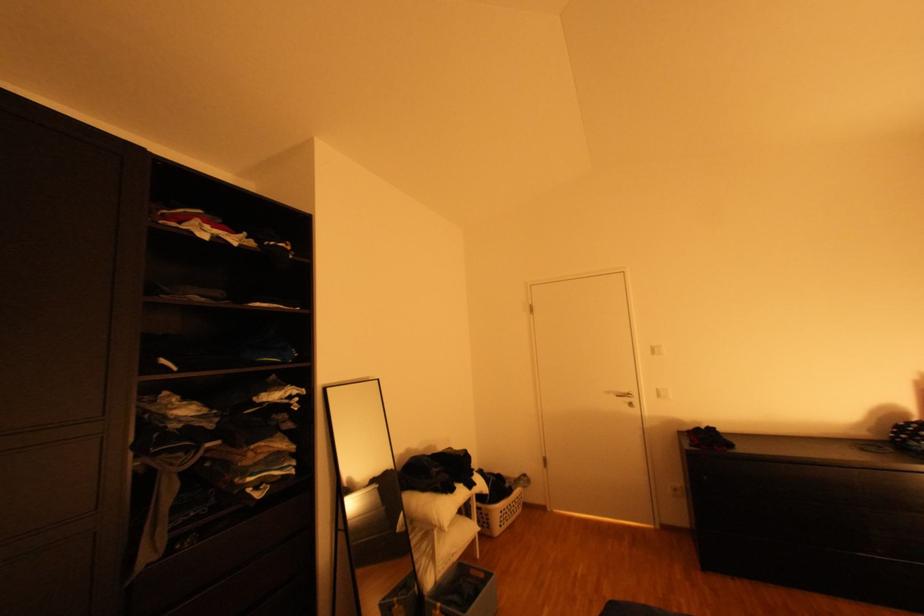
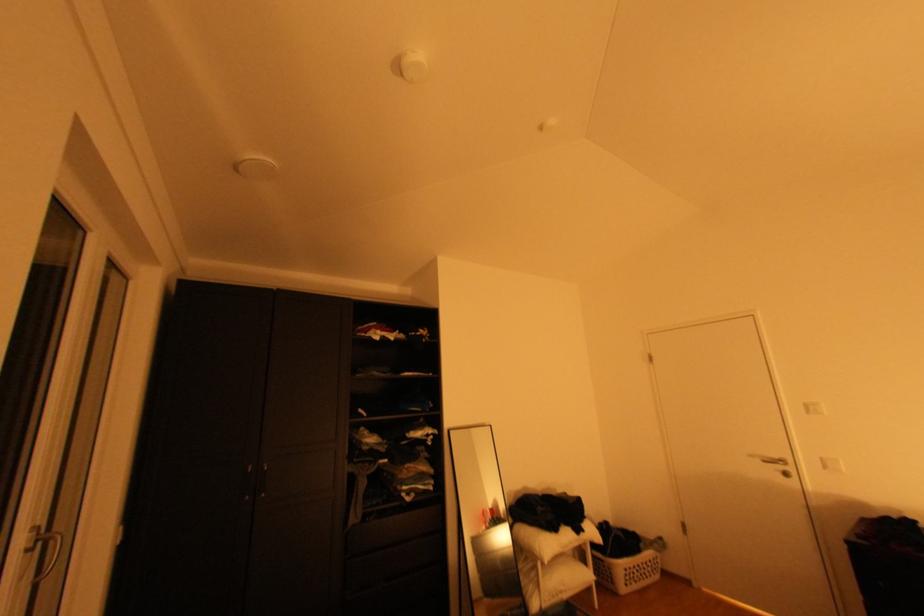
Question: The images are taken continuously from a first-person perspective. In which direction is your viewpoint rotating?

Choices:
 (A) Left
 (B) Right
 (C) Up
 (D) Down

Answer: (A)